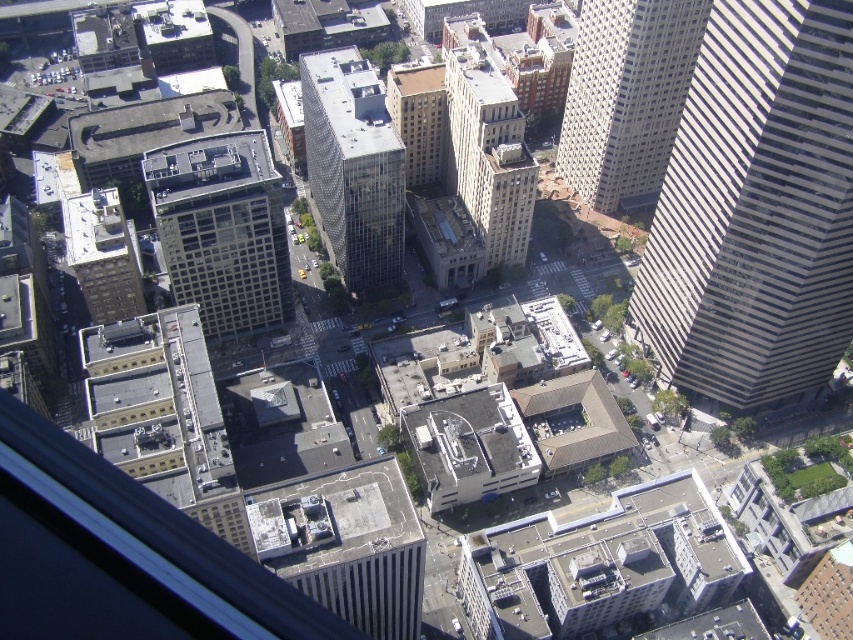
Between point (198, 236) and point (432, 141), which one is positioned behind?

Point (432, 141)

Can you confirm if matte glass skyscraper at center is shorter than brown glass building at center?

No, matte glass skyscraper at center is not shorter than brown glass building at center.

Which is in front, point (222, 208) or point (434, 177)?

Point (222, 208) is more forward.

Locate an element on the screen. matte glass skyscraper at center is located at coordinates (222, 228).

Which is more to the right, matte glass skyscraper at center or brown brick building at left?

From the viewer's perspective, matte glass skyscraper at center appears more on the right side.

Between matte glass skyscraper at center and brown brick building at left, which one is positioned higher?

Positioned higher is matte glass skyscraper at center.

At what (x,y) coordinates should I click in order to perform the action: click on matte glass skyscraper at center. Please return your answer as a coordinate pair (x, y). Looking at the image, I should click on (222, 228).

Is white glass skyscraper at right above brown brick building at center?

No.

Is white glass skyscraper at right thinner than brown brick building at center?

In fact, white glass skyscraper at right might be wider than brown brick building at center.

This screenshot has width=853, height=640. I want to click on white glass skyscraper at right, so click(x=756, y=208).